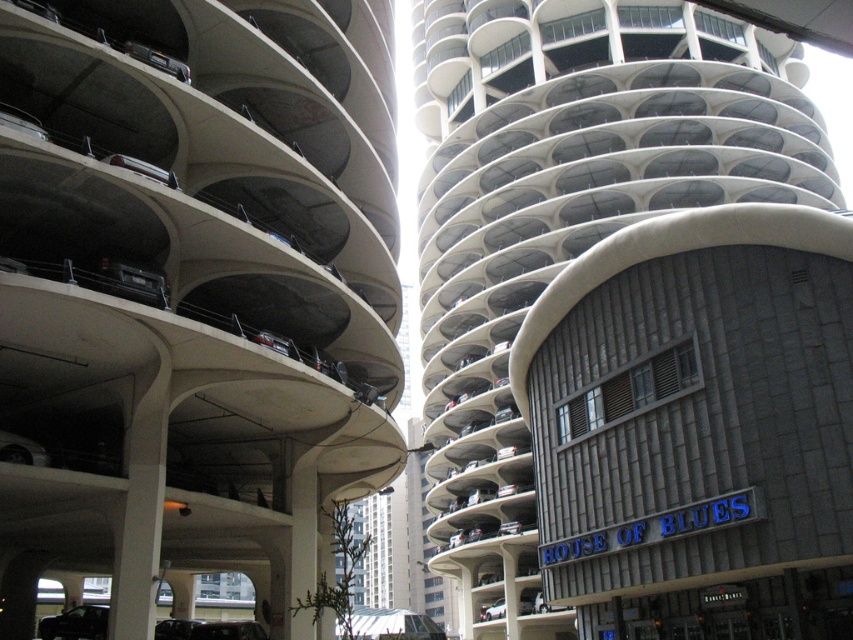
You are a delivery driver who needs to park your vehicle in the multi level parking garage on the left. The parking spot you want is marked by the point at coordinates (x=74, y=624). What type of vehicle is already parked there?

The point at coordinates (x=74, y=624) marks a shiny black suv at lower left, so the parking spot is occupied by a shiny black suv at lower left.

You are a pedestrian standing at the entrance of the parking garage. You see the shiny black suv at lower left and the black glossy car at lower center. Which car is closer to you?

The shiny black suv at lower left is closer to you because the black glossy car at lower center is behind it.